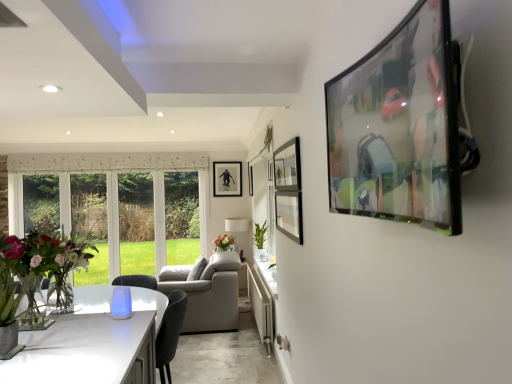
Question: Is the position of translucent glass vase at center less distant than that of matte black tv at upper right, the 1th picture frame viewed from the front?

Choices:
 (A) yes
 (B) no

Answer: (B)

Question: Can you confirm if translucent glass vase at center is thinner than matte black tv at upper right, the 3th picture frame from the left?

Choices:
 (A) yes
 (B) no

Answer: (B)

Question: Considering the relative sizes of translucent glass vase at center and matte black tv at upper right, marked as the third picture frame in a back-to-front arrangement, in the image provided, is translucent glass vase at center smaller than matte black tv at upper right, marked as the third picture frame in a back-to-front arrangement,?

Choices:
 (A) no
 (B) yes

Answer: (B)

Question: Does translucent glass vase at center come behind matte black tv at upper right, marked as the third picture frame in a back-to-front arrangement?

Choices:
 (A) no
 (B) yes

Answer: (B)

Question: Can you confirm if translucent glass vase at center is wider than matte black tv at upper right, arranged as the first picture frame when viewed from the right?

Choices:
 (A) no
 (B) yes

Answer: (B)

Question: From a real-world perspective, is translucent glass vase at center below matte black tv at upper right, arranged as the first picture frame when viewed from the right?

Choices:
 (A) no
 (B) yes

Answer: (B)

Question: From a real-world perspective, is matte glass vase at left under green glossy plant at center?

Choices:
 (A) yes
 (B) no

Answer: (B)

Question: Can you confirm if matte glass vase at left is positioned to the right of green glossy plant at center?

Choices:
 (A) no
 (B) yes

Answer: (A)

Question: Does matte glass vase at left turn towards green glossy plant at center?

Choices:
 (A) no
 (B) yes

Answer: (A)

Question: Are matte glass vase at left and green glossy plant at center beside each other?

Choices:
 (A) yes
 (B) no

Answer: (B)

Question: Is matte glass vase at left facing away from green glossy plant at center?

Choices:
 (A) no
 (B) yes

Answer: (A)

Question: From the image's perspective, is matte glass vase at left under green glossy plant at center?

Choices:
 (A) no
 (B) yes

Answer: (A)

Question: Considering the relative positions of matte black picture frame at center, arranged as the second picture frame when viewed from the right, and green glossy plant at center in the image provided, is matte black picture frame at center, arranged as the second picture frame when viewed from the right, to the right of green glossy plant at center from the viewer's perspective?

Choices:
 (A) yes
 (B) no

Answer: (B)